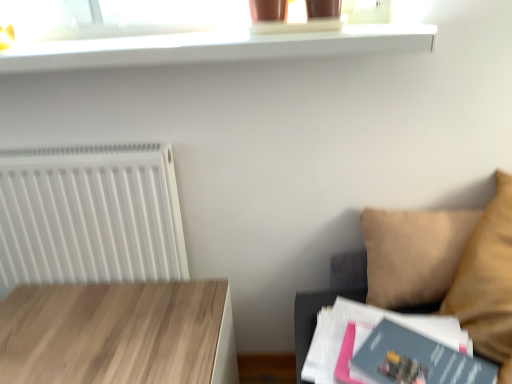
Question: From the image's perspective, is light wood table at lower left beneath matte gray paperback book at lower right, which is the 2th paperback book from back to front?

Choices:
 (A) no
 (B) yes

Answer: (B)

Question: Considering the relative positions of light wood table at lower left and matte gray paperback book at lower right, the first paperback book positioned from the front, in the image provided, is light wood table at lower left to the right of matte gray paperback book at lower right, the first paperback book positioned from the front, from the viewer's perspective?

Choices:
 (A) yes
 (B) no

Answer: (B)

Question: From a real-world perspective, is light wood table at lower left positioned under matte gray paperback book at lower right, which is the 2th paperback book from back to front, based on gravity?

Choices:
 (A) no
 (B) yes

Answer: (B)

Question: Considering the relative sizes of light wood table at lower left and matte gray paperback book at lower right, the first paperback book positioned from the front, in the image provided, is light wood table at lower left smaller than matte gray paperback book at lower right, the first paperback book positioned from the front,?

Choices:
 (A) yes
 (B) no

Answer: (B)

Question: Does light wood table at lower left have a greater height compared to matte gray paperback book at lower right, the first paperback book positioned from the front?

Choices:
 (A) yes
 (B) no

Answer: (A)

Question: From the image's perspective, is light wood table at lower left on matte gray paperback book at lower right, which is the 2th paperback book from back to front?

Choices:
 (A) yes
 (B) no

Answer: (B)

Question: Considering the relative sizes of beige fabric couch at right and white plastic radiator at left in the image provided, is beige fabric couch at right taller than white plastic radiator at left?

Choices:
 (A) no
 (B) yes

Answer: (A)

Question: Does beige fabric couch at right have a smaller size compared to white plastic radiator at left?

Choices:
 (A) yes
 (B) no

Answer: (B)

Question: Is beige fabric couch at right facing away from white plastic radiator at left?

Choices:
 (A) yes
 (B) no

Answer: (B)

Question: From a real-world perspective, is beige fabric couch at right physically above white plastic radiator at left?

Choices:
 (A) no
 (B) yes

Answer: (A)

Question: From a real-world perspective, is beige fabric couch at right beneath white plastic radiator at left?

Choices:
 (A) no
 (B) yes

Answer: (B)

Question: Can you confirm if beige fabric couch at right is shorter than white plastic radiator at left?

Choices:
 (A) no
 (B) yes

Answer: (B)

Question: Is light wood table at lower left wider than white glossy shelf at upper center?

Choices:
 (A) no
 (B) yes

Answer: (B)